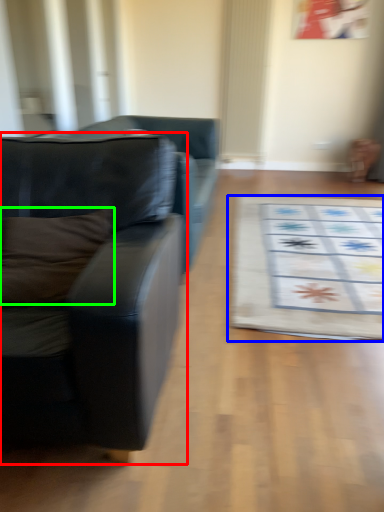
Question: Based on their relative distances, which object is nearer to studio couch (highlighted by a red box)? Choose from mat (highlighted by a blue box) and pillow (highlighted by a green box).

Choices:
 (A) mat
 (B) pillow

Answer: (B)